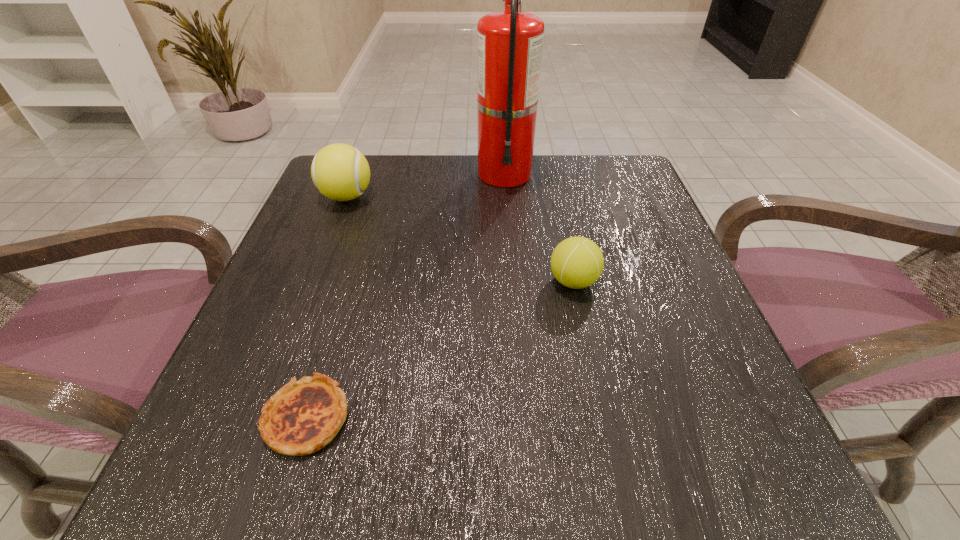
Find the location of `vacant area at the near edge of the desktop`. vacant area at the near edge of the desktop is located at coordinates (502, 428).

Locate an element on the screen. The image size is (960, 540). free space at the left edge of the desktop is located at coordinates (309, 305).

The image size is (960, 540). In the image, there is a desktop. Identify the location of vacant space at the right edge. (644, 253).

In the image, there is a desktop. Where is `blank space at the far right corner`? The width and height of the screenshot is (960, 540). blank space at the far right corner is located at coordinates pyautogui.click(x=621, y=177).

In the image, there is a desktop. Identify the location of free region at the near right corner. The height and width of the screenshot is (540, 960). pos(774,451).

Identify the location of empty space that is in between the left tennis ball and the fire extinguisher. (425, 185).

Locate an element on the screen. The image size is (960, 540). free area in between the quiche and the tallest object is located at coordinates click(x=405, y=295).

The width and height of the screenshot is (960, 540). Find the location of `empty space between the quiche and the nearer tennis ball`. empty space between the quiche and the nearer tennis ball is located at coordinates (440, 349).

The height and width of the screenshot is (540, 960). Find the location of `free point between the left tennis ball and the tallest object`. free point between the left tennis ball and the tallest object is located at coordinates (425, 185).

I want to click on free space between the left tennis ball and the tallest object, so click(x=425, y=185).